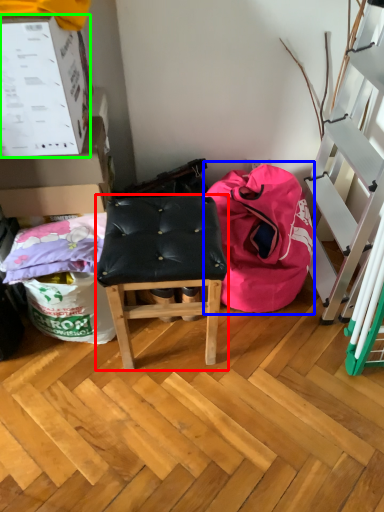
Question: Which object is the closest to the stool (highlighted by a red box)? Choose among these: bean bag chair (highlighted by a blue box) or box (highlighted by a green box).

Choices:
 (A) bean bag chair
 (B) box

Answer: (A)